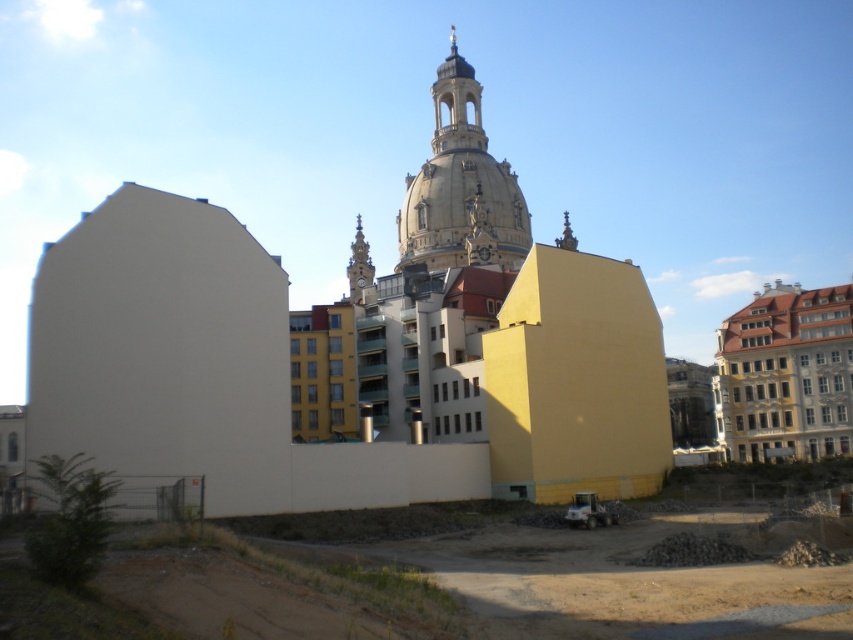
Question: Is the position of smooth concrete ground at lower center more distant than that of yellow painted building at right?

Choices:
 (A) yes
 (B) no

Answer: (B)

Question: Among these objects, which one is farthest from the camera?

Choices:
 (A) beige stone dome at center
 (B) smooth concrete ground at lower center
 (C) yellow painted building at right

Answer: (A)

Question: Can you confirm if smooth concrete ground at lower center is bigger than yellow painted building at right?

Choices:
 (A) no
 (B) yes

Answer: (B)

Question: Which point is farther from the camera taking this photo?

Choices:
 (A) (561, 573)
 (B) (550, 433)
 (C) (524, 246)
 (D) (822, 317)

Answer: (C)

Question: Does smooth stone church at center have a larger size compared to yellow painted building at right?

Choices:
 (A) no
 (B) yes

Answer: (B)

Question: Estimate the real-world distances between objects in this image. Which object is farther from the smooth concrete ground at lower center?

Choices:
 (A) smooth stone church at center
 (B) yellow painted building at right
 (C) beige stone dome at center

Answer: (C)